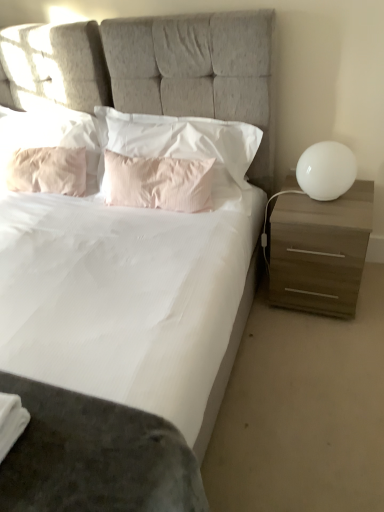
Question: Is pink fabric pillow at upper left, arranged as the 4th pillow when viewed from the right, at the left side of pink cotton pillow at center, arranged as the 1th pillow when viewed from the right?

Choices:
 (A) yes
 (B) no

Answer: (A)

Question: From a real-world perspective, does pink fabric pillow at upper left, arranged as the 4th pillow when viewed from the right, stand above pink cotton pillow at center, which appears as the fourth pillow when viewed from the left?

Choices:
 (A) no
 (B) yes

Answer: (A)

Question: From the image's perspective, is pink fabric pillow at upper left, the 1th pillow in the left-to-right sequence, below pink cotton pillow at center, arranged as the 1th pillow when viewed from the right?

Choices:
 (A) yes
 (B) no

Answer: (A)

Question: Does pink fabric pillow at upper left, the 1th pillow in the left-to-right sequence, turn towards pink cotton pillow at center, which appears as the fourth pillow when viewed from the left?

Choices:
 (A) no
 (B) yes

Answer: (A)

Question: Is pink fabric pillow at upper left, arranged as the 4th pillow when viewed from the right, further to the viewer compared to pink cotton pillow at center, which appears as the fourth pillow when viewed from the left?

Choices:
 (A) no
 (B) yes

Answer: (B)

Question: Is pink fabric pillow at upper left, arranged as the 4th pillow when viewed from the right, positioned in front of pink cotton pillow at center, arranged as the 1th pillow when viewed from the right?

Choices:
 (A) yes
 (B) no

Answer: (B)

Question: Is pink fabric pillow at upper left, arranged as the 4th pillow when viewed from the right, smaller than pink satin pillow at center, the 3th pillow in the left-to-right sequence?

Choices:
 (A) no
 (B) yes

Answer: (A)

Question: From a real-world perspective, is pink fabric pillow at upper left, the 1th pillow in the left-to-right sequence, over pink satin pillow at center, marked as the 2th pillow in a right-to-left arrangement?

Choices:
 (A) yes
 (B) no

Answer: (A)

Question: Is the surface of pink fabric pillow at upper left, the 1th pillow in the left-to-right sequence, in direct contact with pink satin pillow at center, the 3th pillow in the left-to-right sequence?

Choices:
 (A) no
 (B) yes

Answer: (A)

Question: Are pink fabric pillow at upper left, the 1th pillow in the left-to-right sequence, and pink satin pillow at center, the 3th pillow in the left-to-right sequence, located far from each other?

Choices:
 (A) yes
 (B) no

Answer: (B)

Question: Does pink fabric pillow at upper left, arranged as the 4th pillow when viewed from the right, appear on the left side of pink satin pillow at center, marked as the 2th pillow in a right-to-left arrangement?

Choices:
 (A) yes
 (B) no

Answer: (A)

Question: Is pink fabric pillow at upper left, the 1th pillow in the left-to-right sequence, bigger than pink satin pillow at center, marked as the 2th pillow in a right-to-left arrangement?

Choices:
 (A) yes
 (B) no

Answer: (A)

Question: Considering the relative positions of white fabric bed at center and white glossy sphere at right in the image provided, is white fabric bed at center to the left of white glossy sphere at right from the viewer's perspective?

Choices:
 (A) no
 (B) yes

Answer: (B)